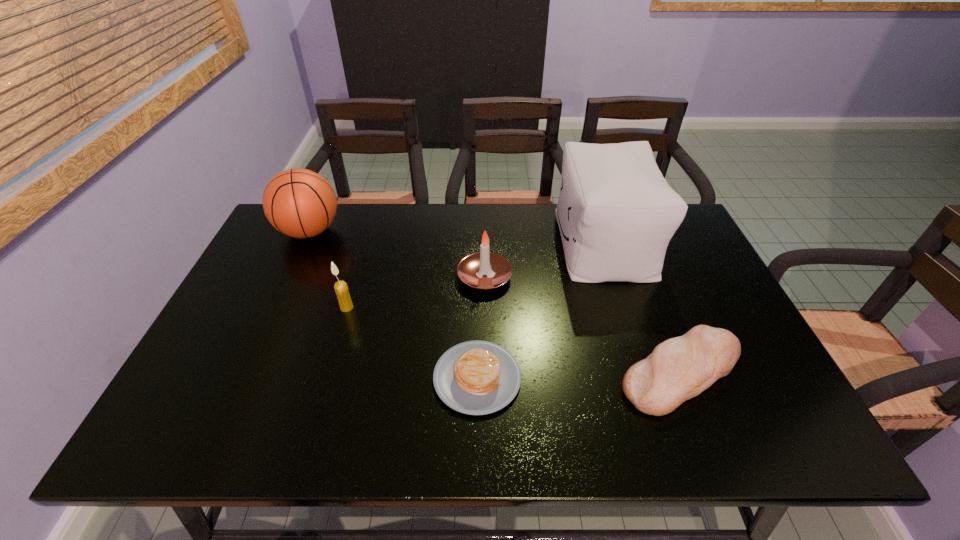
This screenshot has height=540, width=960. I want to click on vacant region located on the side of the tallest object with the smiley face, so click(541, 242).

The height and width of the screenshot is (540, 960). I want to click on free space located 0.150m on the right of the leftmost object, so click(390, 232).

Find the location of `free location located on the right of the second object from left to right`. free location located on the right of the second object from left to right is located at coordinates (501, 307).

The width and height of the screenshot is (960, 540). Find the location of `blank space located on the front of the farther candle`. blank space located on the front of the farther candle is located at coordinates (486, 356).

This screenshot has height=540, width=960. Identify the location of free space located 0.140m on the left of the bread. (555, 373).

This screenshot has width=960, height=540. What are the coordinates of `blank area located 0.220m on the left of the shortest object` in the screenshot? It's located at (337, 377).

What are the coordinates of `cushion positioned at the far edge` in the screenshot? It's located at (616, 213).

Locate an element on the screen. Image resolution: width=960 pixels, height=540 pixels. basketball present at the far edge is located at coordinates (300, 203).

In order to click on bread located in the near edge section of the desktop in this screenshot , I will do `click(678, 369)`.

Where is `pancake that is at the near edge`? pancake that is at the near edge is located at coordinates (476, 377).